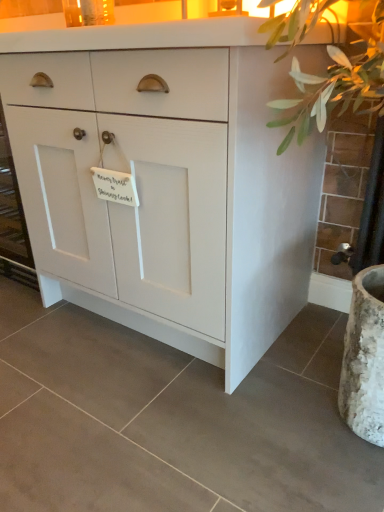
Image resolution: width=384 pixels, height=512 pixels. In order to click on white matte cabinet at center in this screenshot , I will do `click(166, 182)`.

What do you see at coordinates (166, 182) in the screenshot? I see `white matte cabinet at center` at bounding box center [166, 182].

This screenshot has width=384, height=512. What are the coordinates of `white matte cabinet at center` in the screenshot? It's located at (166, 182).